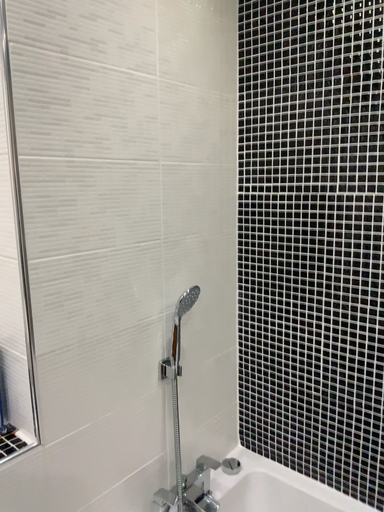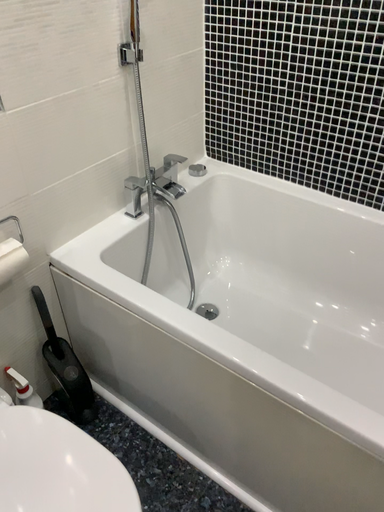
Question: Which way did the camera rotate in the video?

Choices:
 (A) rotated downward
 (B) rotated upward

Answer: (A)